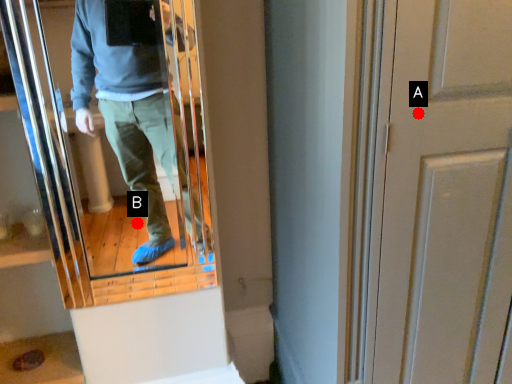
Question: Two points are circled on the image, labeled by A and B beside each circle. Which of the following is the farthest from the observer?

Choices:
 (A) A is further
 (B) B is further

Answer: (B)